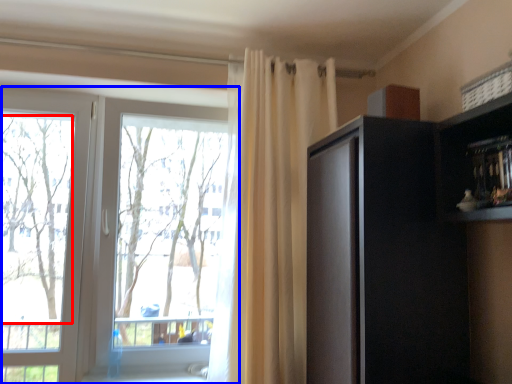
Question: Which object is further to the camera taking this photo, tree (highlighted by a red box) or window (highlighted by a blue box)?

Choices:
 (A) tree
 (B) window

Answer: (A)